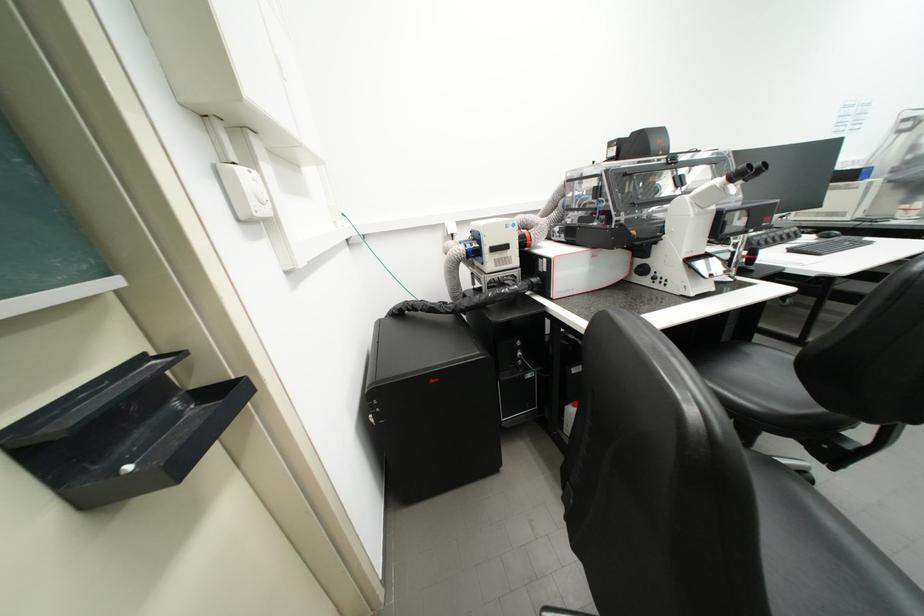
What do you see at coordinates (772, 379) in the screenshot? I see `a black chair sitting surface` at bounding box center [772, 379].